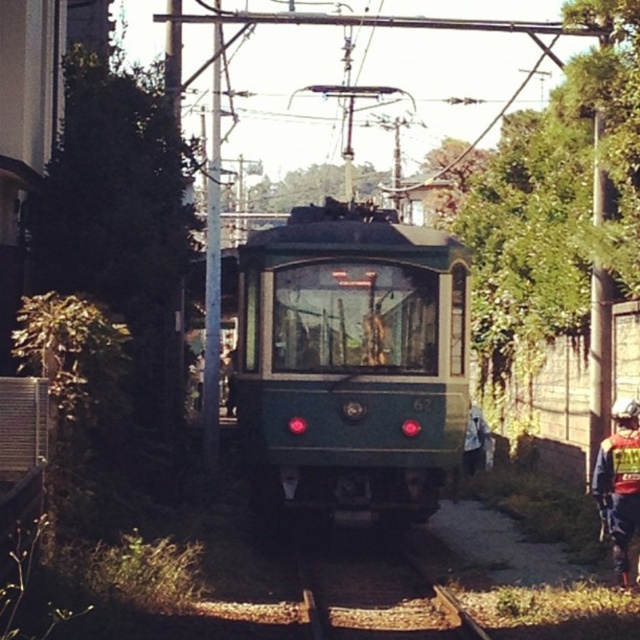
From the picture: Between green polished wood train at center and reflective silver helmet at lower right, which one appears on the left side from the viewer's perspective?

From the viewer's perspective, green polished wood train at center appears more on the left side.

Describe the element at coordinates (348, 362) in the screenshot. The width and height of the screenshot is (640, 640). I see `green polished wood train at center` at that location.

Where is `green polished wood train at center`? Image resolution: width=640 pixels, height=640 pixels. green polished wood train at center is located at coordinates (348, 362).